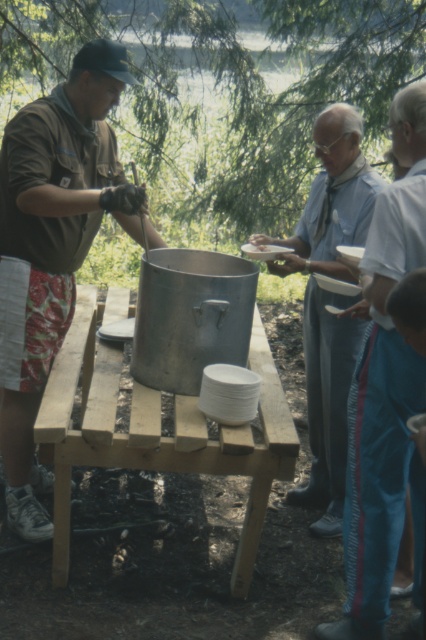
Is the position of brushed metal pot at left more distant than that of wooden table at center?

Yes, brushed metal pot at left is further from the viewer.

Who is lower down, brushed metal pot at left or wooden table at center?

wooden table at center

Who is more distant from viewer, (31, 120) or (253, 502)?

Positioned behind is point (31, 120).

I want to click on brushed metal pot at left, so click(51, 248).

Who is positioned more to the right, blue cotton shirt at center or white matte plate at center?

blue cotton shirt at center

Can you confirm if blue cotton shirt at center is shorter than white matte plate at center?

No.

You are a GUI agent. You are given a task and a screenshot of the screen. Output one action in this format:
    pyautogui.click(x=<x>, y=<y>)
    Task: Click on the blue cotton shirt at center
    The image size is (426, 640).
    Given the screenshot: What is the action you would take?
    pyautogui.click(x=328, y=300)

Is brushed metal pot at left positioned behind blue cotton shirt at center?

No, brushed metal pot at left is closer to the viewer.

Can you confirm if brushed metal pot at left is smaller than blue cotton shirt at center?

No, brushed metal pot at left is not smaller than blue cotton shirt at center.

Where is `brushed metal pot at left`? brushed metal pot at left is located at coordinates (51, 248).